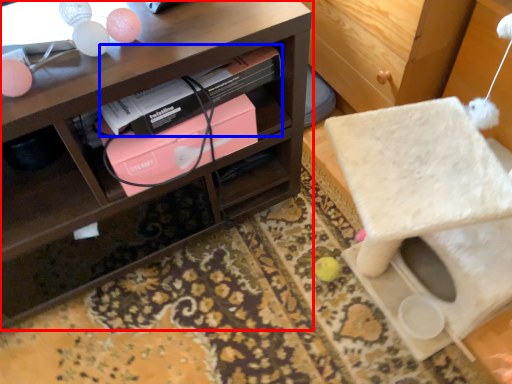
Question: Which point is closer to the camera, shelf (highlighted by a red box) or book (highlighted by a blue box)?

Choices:
 (A) shelf
 (B) book

Answer: (A)